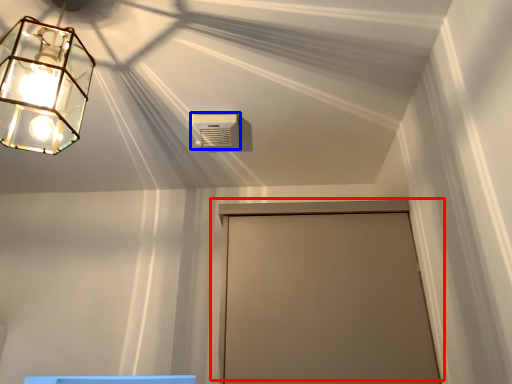
Question: Among these objects, which one is nearest to the camera, door (highlighted by a red box) or air conditioning (highlighted by a blue box)?

Choices:
 (A) door
 (B) air conditioning

Answer: (A)